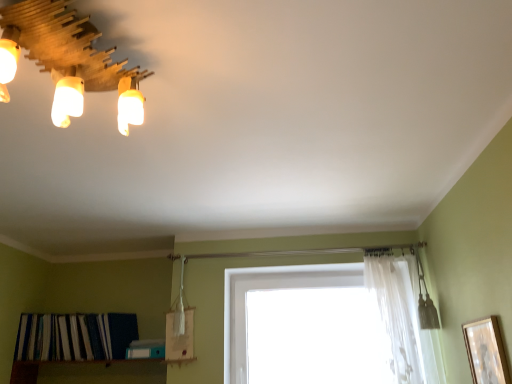
Image resolution: width=512 pixels, height=384 pixels. What do you see at coordinates (75, 336) in the screenshot? I see `striped fabric at lower left` at bounding box center [75, 336].

Find the location of a particular element. This screenshot has width=512, height=384. white sheer curtain at upper center is located at coordinates (402, 319).

Describe the element at coordinates (402, 319) in the screenshot. I see `white sheer curtain at upper center` at that location.

This screenshot has width=512, height=384. Describe the element at coordinates (67, 46) in the screenshot. I see `wooden light fixture at upper left` at that location.

Image resolution: width=512 pixels, height=384 pixels. In order to click on wooden picture frame at right in this screenshot , I will do `click(486, 351)`.

From the image's perspective, between wooden light fixture at upper left and transparent glass window at center, which one is located above?

wooden light fixture at upper left.

Considering the positions of objects wooden light fixture at upper left and transparent glass window at center in the image provided, who is more to the right, wooden light fixture at upper left or transparent glass window at center?

Positioned to the right is transparent glass window at center.

Which object is thinner, wooden light fixture at upper left or transparent glass window at center?

With smaller width is transparent glass window at center.

Considering the sizes of wooden light fixture at upper left and striped fabric at lower left in the image, is wooden light fixture at upper left bigger or smaller than striped fabric at lower left?

Clearly, wooden light fixture at upper left is smaller in size than striped fabric at lower left.

Locate an element on the screen. Image resolution: width=512 pixels, height=384 pixels. shelf behind the wooden light fixture at upper left is located at coordinates (75, 336).

From the picture: Is striped fabric at lower left surrounded by wooden light fixture at upper left?

That's incorrect, striped fabric at lower left is not inside wooden light fixture at upper left.

Is wooden light fixture at upper left closer to camera compared to striped fabric at lower left?

Yes, wooden light fixture at upper left is closer to the viewer.

Considering the sizes of objects wooden picture frame at right and striped fabric at lower left in the image provided, who is shorter, wooden picture frame at right or striped fabric at lower left?

Standing shorter between the two is wooden picture frame at right.

Would you say wooden picture frame at right is a long distance from striped fabric at lower left?

That's right, there is a large distance between wooden picture frame at right and striped fabric at lower left.

This screenshot has width=512, height=384. I want to click on shelf behind the wooden picture frame at right, so click(75, 336).

In the scene shown: Does wooden picture frame at right contain striped fabric at lower left?

Definitely not — striped fabric at lower left is not inside wooden picture frame at right.

Looking at this image, in the image, is wooden picture frame at right positioned in front of or behind white sheer curtain at upper center?

wooden picture frame at right is in front of white sheer curtain at upper center.

From a real-world perspective, does wooden picture frame at right stand above white sheer curtain at upper center?

No, from a real-world perspective, wooden picture frame at right is not over white sheer curtain at upper center

You are a GUI agent. You are given a task and a screenshot of the screen. Output one action in this format:
    pyautogui.click(x=<x>, y=<y>)
    Task: Click on the picture frame on the right of white sheer curtain at upper center
    This screenshot has width=512, height=384.
    Given the screenshot: What is the action you would take?
    point(486,351)

Does wooden picture frame at right have a smaller size compared to white sheer curtain at upper center?

Yes.

Does striped fabric at lower left have a lesser width compared to white sheer curtain at upper center?

No.

Where is `curtain above the striped fabric at lower left (from the image's perspective)`? The width and height of the screenshot is (512, 384). curtain above the striped fabric at lower left (from the image's perspective) is located at coordinates (402, 319).

Is white sheer curtain at upper center at the back of striped fabric at lower left?

No, striped fabric at lower left's orientation is not away from white sheer curtain at upper center.

Which object is closer to the camera taking this photo, striped fabric at lower left or white sheer curtain at upper center?

white sheer curtain at upper center is in front.

Considering their positions, is transparent glass window at center located in front of or behind striped fabric at lower left?

transparent glass window at center is positioned closer to the viewer than striped fabric at lower left.

Is transparent glass window at center next to striped fabric at lower left?

No, transparent glass window at center is not next to striped fabric at lower left.

Is transparent glass window at center located outside striped fabric at lower left?

Absolutely, transparent glass window at center is external to striped fabric at lower left.

Is striped fabric at lower left in front of or behind transparent glass window at center in the image?

striped fabric at lower left is positioned farther from the viewer than transparent glass window at center.

Is striped fabric at lower left in contact with transparent glass window at center?

No, striped fabric at lower left is not next to transparent glass window at center.

Is striped fabric at lower left looking in the opposite direction of transparent glass window at center?

That's not correct — striped fabric at lower left is not looking away from transparent glass window at center.

Where is `window to the right of wooden light fixture at upper left`? Image resolution: width=512 pixels, height=384 pixels. window to the right of wooden light fixture at upper left is located at coordinates (328, 325).

Locate an element on the screen. The height and width of the screenshot is (384, 512). shelf located behind the wooden light fixture at upper left is located at coordinates (75, 336).

Looking at this image, based on their spatial positions, is white sheer curtain at upper center or transparent glass window at center closer to striped fabric at lower left?

Based on the image, transparent glass window at center appears to be nearer to striped fabric at lower left.

Based on their spatial positions, is wooden light fixture at upper left or white sheer curtain at upper center further from transparent glass window at center?

wooden light fixture at upper left lies further to transparent glass window at center than the other object.

Estimate the real-world distances between objects in this image. Which object is closer to transparent glass window at center, wooden picture frame at right or striped fabric at lower left?

wooden picture frame at right lies closer to transparent glass window at center than the other object.

Based on their spatial positions, is wooden light fixture at upper left or striped fabric at lower left closer to wooden picture frame at right?

wooden light fixture at upper left is positioned closer to the anchor wooden picture frame at right.

When comparing their distances from transparent glass window at center, does wooden picture frame at right or white sheer curtain at upper center seem closer?

Based on the image, white sheer curtain at upper center appears to be nearer to transparent glass window at center.

Looking at the image, which one is located further to transparent glass window at center, striped fabric at lower left or white sheer curtain at upper center?

Among the two, striped fabric at lower left is located further to transparent glass window at center.

Estimate the real-world distances between objects in this image. Which object is closer to white sheer curtain at upper center, striped fabric at lower left or transparent glass window at center?

transparent glass window at center is positioned closer to the anchor white sheer curtain at upper center.

From the image, which object appears to be farther from white sheer curtain at upper center, striped fabric at lower left or wooden picture frame at right?

Based on the image, striped fabric at lower left appears to be further to white sheer curtain at upper center.

You are a GUI agent. You are given a task and a screenshot of the screen. Output one action in this format:
    pyautogui.click(x=<x>, y=<y>)
    Task: Click on the curtain positioned between wooden light fixture at upper left and transparent glass window at center from near to far
    The width and height of the screenshot is (512, 384).
    Given the screenshot: What is the action you would take?
    pyautogui.click(x=402, y=319)

This screenshot has height=384, width=512. Identify the location of curtain positioned between wooden picture frame at right and transparent glass window at center from near to far. (402, 319).

You are a GUI agent. You are given a task and a screenshot of the screen. Output one action in this format:
    pyautogui.click(x=<x>, y=<y>)
    Task: Click on the curtain between wooden light fixture at upper left and wooden picture frame at right from left to right
    The width and height of the screenshot is (512, 384).
    Given the screenshot: What is the action you would take?
    [x=402, y=319]

Where is `curtain positioned between wooden light fixture at upper left and striped fabric at lower left from near to far`? The width and height of the screenshot is (512, 384). curtain positioned between wooden light fixture at upper left and striped fabric at lower left from near to far is located at coordinates (402, 319).